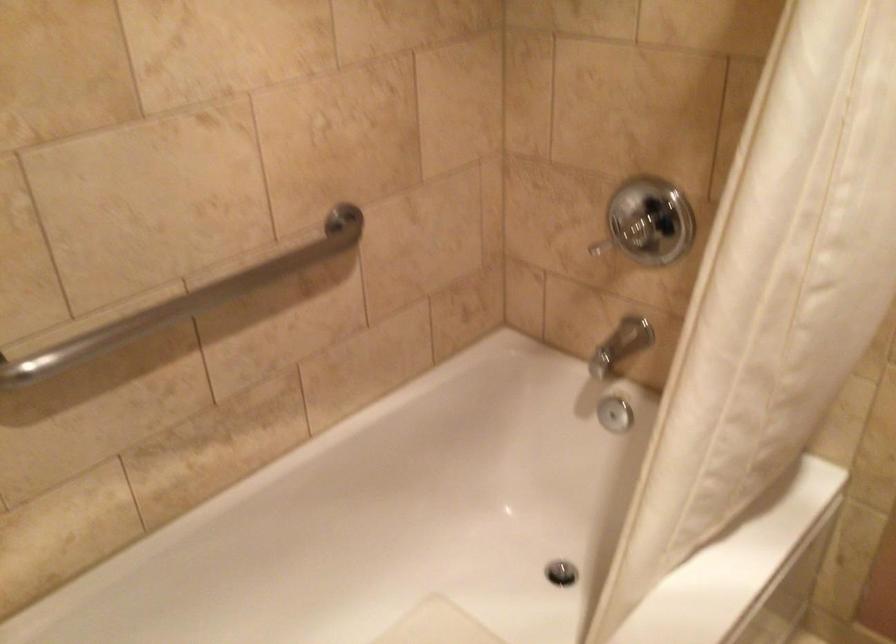
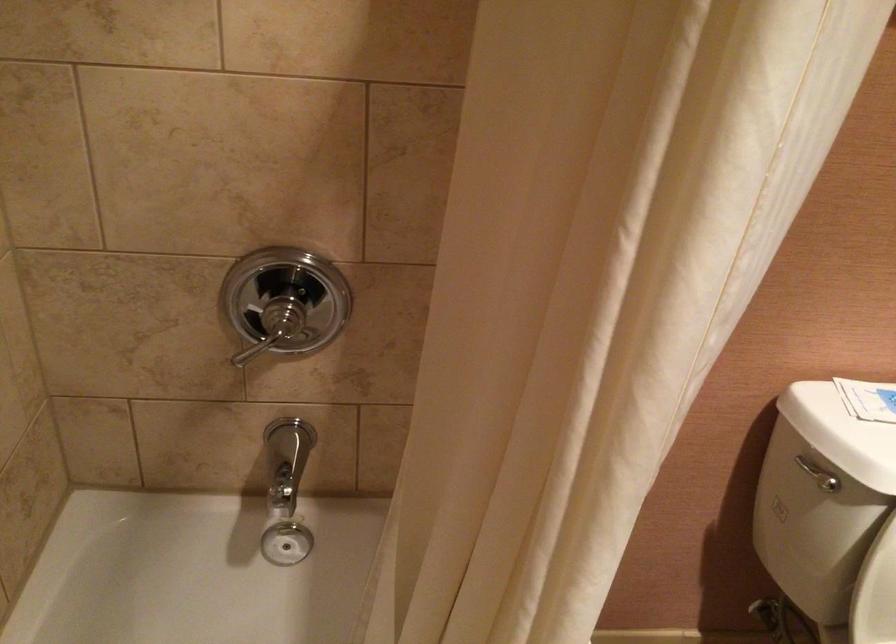
Question: Based on the continuous images, in which direction is the camera rotating? Reply with the corresponding letter.

Choices:
 (A) Left
 (B) Right
 (C) Up
 (D) Down

Answer: (B)